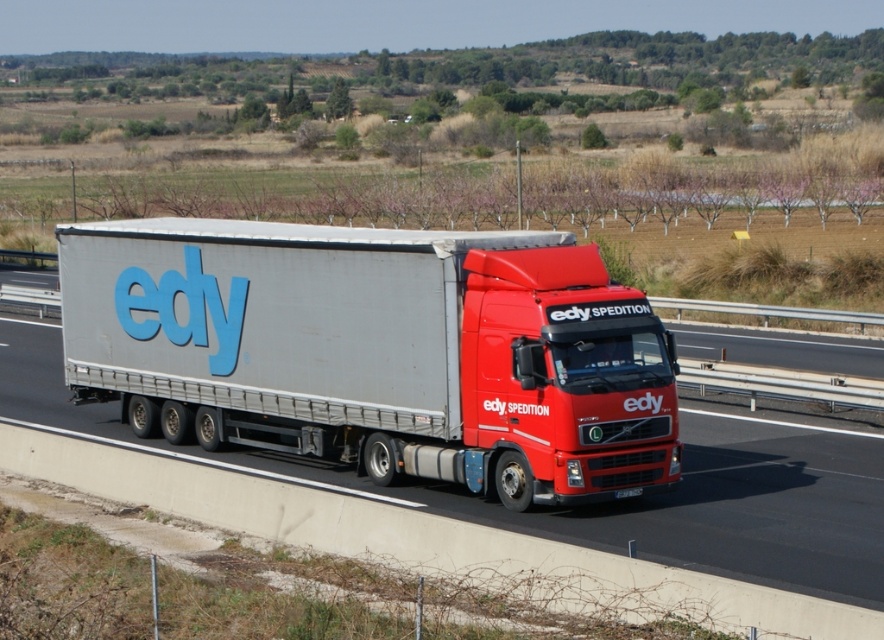
You are a truck driver planning to pass under a bridge that has a height restriction of 4 meters. You are driving a Volvo semi truck with a silver metallic trailer truck at center and a metallic silver trailer at center. Which part of your truck should you be most concerned about fitting under the bridge?

The silver metallic trailer truck at center is taller than the metallic silver trailer at center, so you should be most concerned about the silver metallic trailer truck at center fitting under the bridge since it is the taller component.

You are a truck driver looking at the highway ahead. You see a silver metallic trailer truck at center and a metallic silver trailer at center. Which one is closer to you?

The silver metallic trailer truck at center is closer to you because it is positioned over the metallic silver trailer at center.

You are a truck driver who needs to pass through a narrow tunnel that only allows vehicles with a maximum width of 2.5 meters. You observe the silver metallic trailer truck at center and the metallic silver trailer at center in the image. Which one is more likely to exceed the tunnel width limit?

The metallic silver trailer at center is wider than the silver metallic trailer truck at center. Since the tunnel has a maximum width limit of 2.5 meters, the metallic silver trailer at center is more likely to exceed the tunnel width limit if its width surpasses the limit.